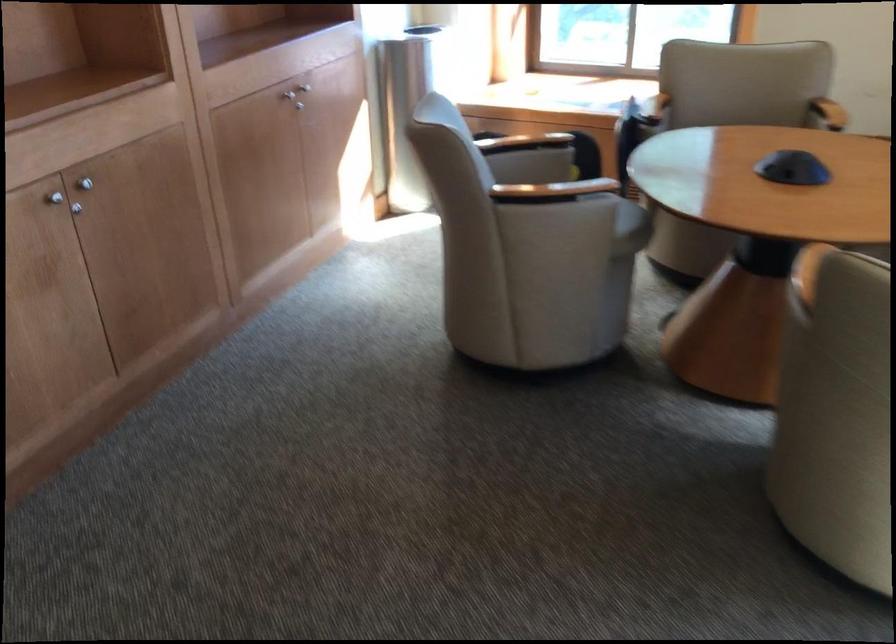
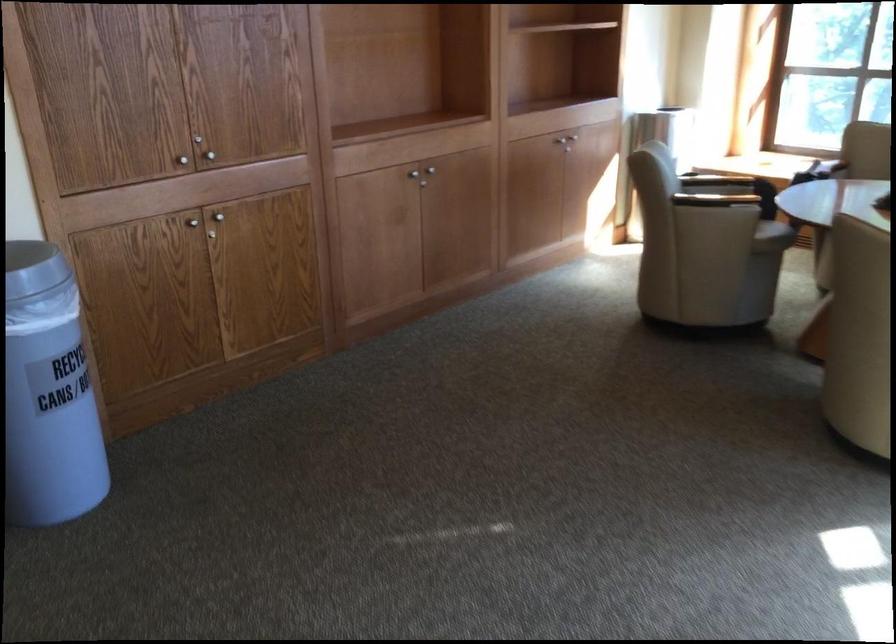
In the second image, find the point that corresponds to the point at 543,151 in the first image.

(731, 178)